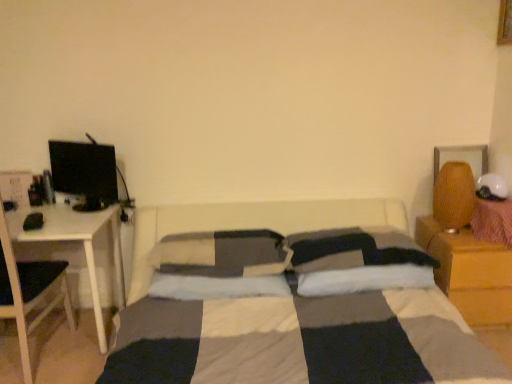
Question: Is white glossy table at left positioned far away from soft gray pillow at center, marked as the second pillow in a right-to-left arrangement?

Choices:
 (A) no
 (B) yes

Answer: (A)

Question: Does white glossy table at left come behind soft gray pillow at center, which ranks as the second pillow in left-to-right order?

Choices:
 (A) yes
 (B) no

Answer: (B)

Question: Is white glossy table at left oriented towards soft gray pillow at center, which ranks as the second pillow in left-to-right order?

Choices:
 (A) yes
 (B) no

Answer: (B)

Question: Is white glossy table at left in front of soft gray pillow at center, which ranks as the second pillow in left-to-right order?

Choices:
 (A) no
 (B) yes

Answer: (B)

Question: Is soft gray pillow at center, which ranks as the second pillow in left-to-right order, a part of white glossy table at left?

Choices:
 (A) no
 (B) yes

Answer: (A)

Question: In terms of size, does white soft pillow at center, which is the 1th pillow in left-to-right order, appear bigger or smaller than wooden nightstand at right?

Choices:
 (A) small
 (B) big

Answer: (A)

Question: From their relative heights in the image, would you say white soft pillow at center, which is the 1th pillow in left-to-right order, is taller or shorter than wooden nightstand at right?

Choices:
 (A) tall
 (B) short

Answer: (B)

Question: Is white soft pillow at center, the 3th pillow when ordered from right to left, to the left or to the right of wooden nightstand at right in the image?

Choices:
 (A) left
 (B) right

Answer: (A)

Question: From the image's perspective, is white soft pillow at center, the 3th pillow when ordered from right to left, located above or below wooden nightstand at right?

Choices:
 (A) below
 (B) above

Answer: (B)

Question: Looking at their shapes, would you say white soft pillow at center, the 3th pillow when ordered from right to left, is wider or thinner than textured brown lampshade at right?

Choices:
 (A) wide
 (B) thin

Answer: (A)

Question: Looking at the image, does white soft pillow at center, which is the 1th pillow in left-to-right order, seem bigger or smaller compared to textured brown lampshade at right?

Choices:
 (A) small
 (B) big

Answer: (B)

Question: From the image's perspective, is white soft pillow at center, which is the 1th pillow in left-to-right order, above or below textured brown lampshade at right?

Choices:
 (A) below
 (B) above

Answer: (A)

Question: Is white soft pillow at center, the 3th pillow when ordered from right to left, taller or shorter than textured brown lampshade at right?

Choices:
 (A) tall
 (B) short

Answer: (B)

Question: Looking at their shapes, would you say white glossy table at left is wider or thinner than black glossy computer monitor at left?

Choices:
 (A) wide
 (B) thin

Answer: (A)

Question: In the image, is white glossy table at left on the left side or the right side of black glossy computer monitor at left?

Choices:
 (A) left
 (B) right

Answer: (A)